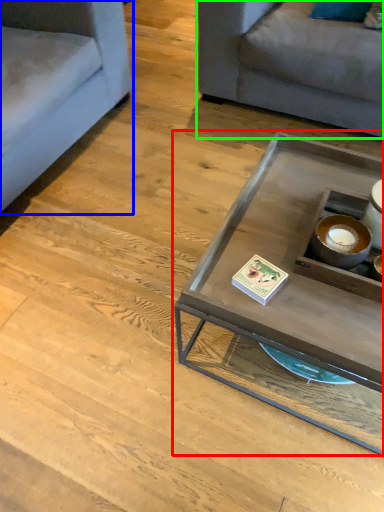
Question: Estimate the real-world distances between objects in this image. Which object is closer to coffee table (highlighted by a red box), studio couch (highlighted by a blue box) or studio couch (highlighted by a green box)?

Choices:
 (A) studio couch
 (B) studio couch

Answer: (B)